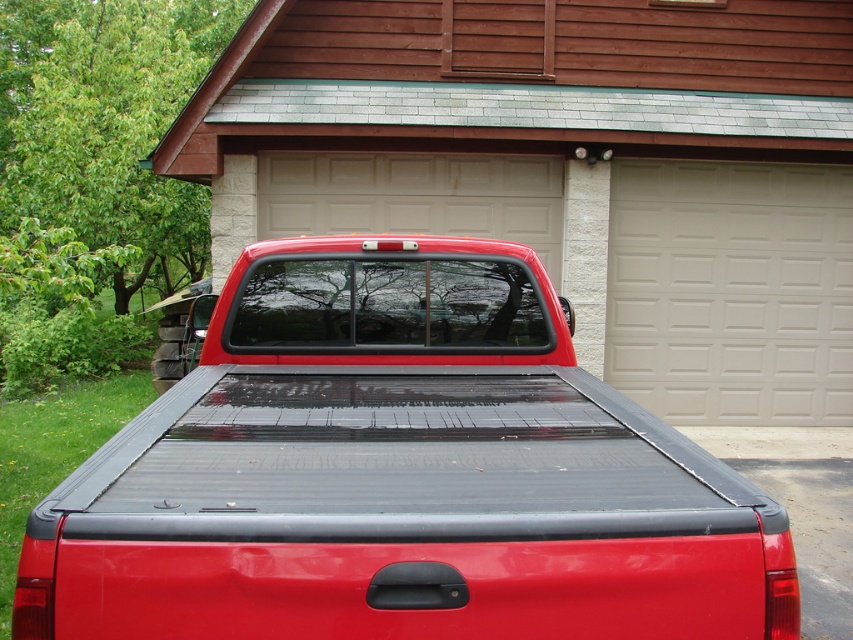
You are standing in front of the garage and want to place a large box on the closest object. Which object should you choose between the matte black truck bed at center and the white textured panel at center?

The matte black truck bed at center is closer to the viewer, so you should place the large box on the matte black truck bed at center.

You are a delivery person who needs to unload a package from the matte black truck bed at center onto the black rubber mat at lower right. Can you place the package directly underneath the truck bed without moving the truck?

The matte black truck bed at center is positioned over the black rubber mat at lower right, so yes, you can place the package directly underneath the truck bed without moving the truck.

You are standing in front of the garage and notice a point marked at coordinates (730, 291). According to the scene description, what object or feature is located at that point?

The point at coordinates 0.458, 0.858 marks the white textured panel at center.